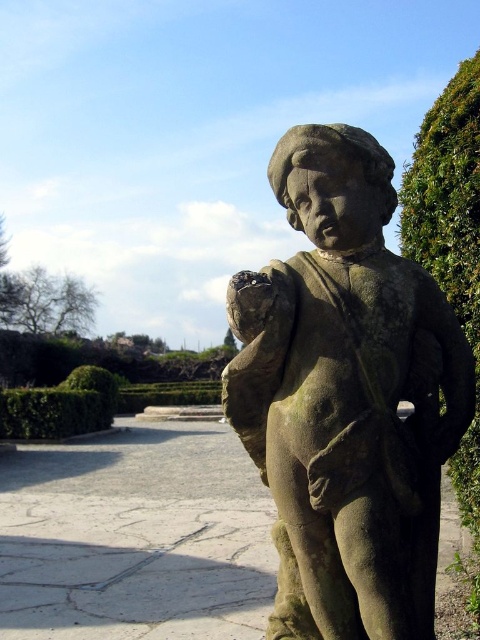
You are a gardener planning to water the green leafy bush at right. The stone statue at center is in the way. Can you move the statue to access the bush?

The stone statue at center is positioned over the green leafy bush at right, so you cannot move the statue to access the bush because it is already placed above it.

You are a gardener planning to water the green leafy bush at right and the stone statue at center. Since the statue is made of stone, you decide to focus on the bush first. Based on their positions, which object is closer to the right edge of the garden path?

The green leafy bush at right is closer to the right edge of the garden path because the stone statue at center is positioned on the left side of it.

You are a gardener planning to trim the green leafy bush at right so that it doesn t block the view of the stone statue at center. Based on their current heights, should you trim the top or the bottom of the bush?

The stone statue at center is shorter than the green leafy bush at right. To ensure the statue is visible, you should trim the top of the green leafy bush at right so it becomes shorter than the statue.